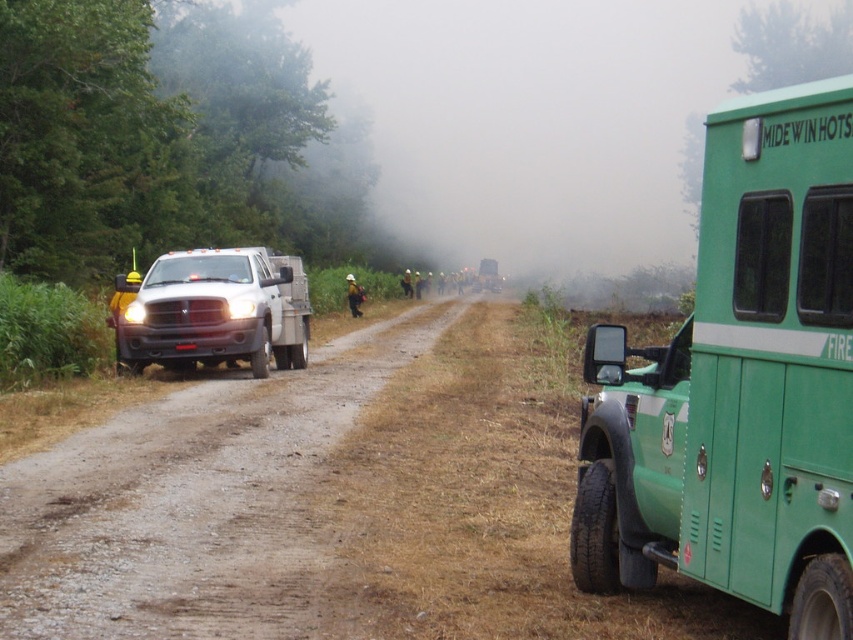
You are a firefighter trying to navigate through the hazy rural area. You see the green matte truck at right and the dusty gravel road at center. Which object appears narrower from your perspective?

The green matte truck at right is thinner than the dusty gravel road at center, so it appears narrower from your perspective.

You are a firefighter planning to drive your truck through the dusty gravel road at center. The matte white truck at left is parked on the same road. Do you think your truck can pass safely? Explain why based on their sizes.

The dusty gravel road at center is bigger than the matte white truck at left. Since the road is larger in size, there should be enough space for your truck to pass safely around the parked matte white truck at left.

Consider the image. You are standing at the point labeled as point (598, 401) in the image. You want to walk to the green firefighting vehicle. Is the green firefighting vehicle located to your left or right side?

The green firefighting vehicle is located to your right side because the point (598, 401) is 19.05 feet away from the viewer, and based on the scene description, the vehicle is in the foreground along the dirt road flanked by greenery, likely positioned to the right when facing the direction of the road.